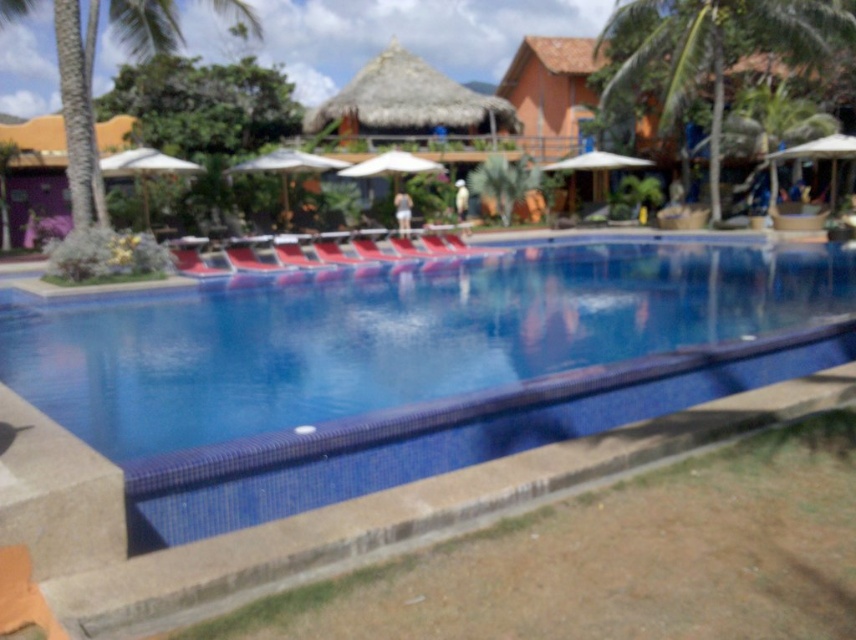
Question: Considering the relative positions of blue tile swimming pool at center and green leafy palm tree at upper left in the image provided, where is blue tile swimming pool at center located with respect to green leafy palm tree at upper left?

Choices:
 (A) above
 (B) below

Answer: (B)

Question: Which point is farther to the camera?

Choices:
 (A) (742, 284)
 (B) (248, 273)
 (C) (531, 4)
 (D) (670, 8)

Answer: (C)

Question: Which point is farther from the camera taking this photo?

Choices:
 (A) (718, 68)
 (B) (122, 17)

Answer: (A)

Question: Among these objects, which one is nearest to the camera?

Choices:
 (A) blue tile swimming pool at center
 (B) white fabric umbrella at center
 (C) green leafy palm tree at upper left
 (D) blue glossy pool at center

Answer: (A)

Question: Is blue tile swimming pool at center positioned at the back of red fabric daybed at center?

Choices:
 (A) yes
 (B) no

Answer: (B)

Question: Is blue glossy pool at center closer to camera compared to green leafy palm tree at upper left?

Choices:
 (A) no
 (B) yes

Answer: (A)